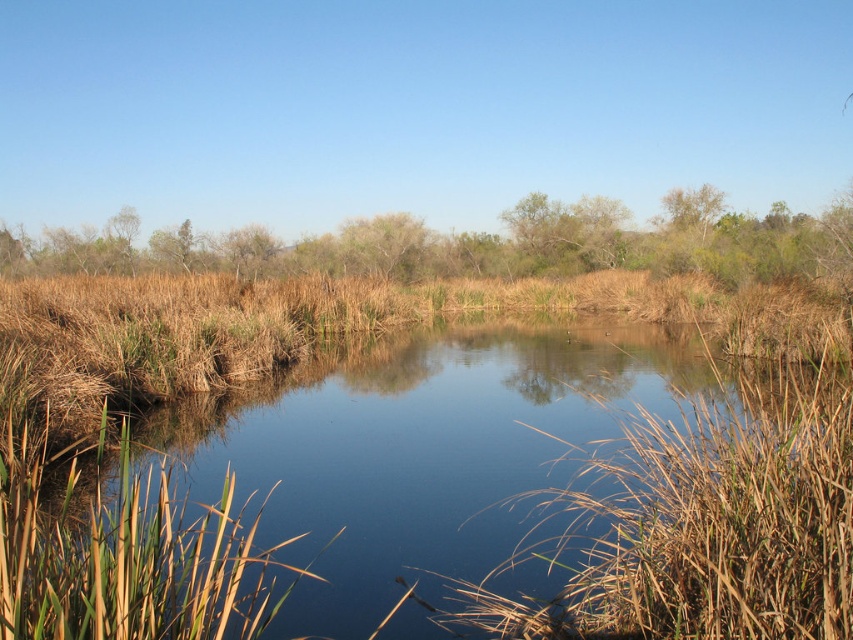
Does point (221, 260) come closer to viewer compared to point (364, 266)?

No, (221, 260) is behind (364, 266).

In order to click on green leafy trees at center in this screenshot , I will do [x=479, y=244].

What are the coordinates of `green leafy trees at center` in the screenshot? It's located at (479, 244).

Who is taller, green leafy tree at center or green leafy tree at upper right?

With more height is green leafy tree at center.

Can you confirm if green leafy tree at center is bigger than green leafy tree at upper right?

Indeed, green leafy tree at center has a larger size compared to green leafy tree at upper right.

Which is behind, point (379, 227) or point (671, 216)?

The point (379, 227) is more distant.

The height and width of the screenshot is (640, 853). Find the location of `green leafy tree at center`. green leafy tree at center is located at coordinates (384, 244).

Is green leafy trees at center shorter than green leafy tree at upper right?

In fact, green leafy trees at center may be taller than green leafy tree at upper right.

Between green leafy trees at center and green leafy tree at upper right, which one appears on the left side from the viewer's perspective?

From the viewer's perspective, green leafy trees at center appears more on the left side.

What do you see at coordinates (479, 244) in the screenshot? I see `green leafy trees at center` at bounding box center [479, 244].

Identify the location of green leafy trees at center. (479, 244).